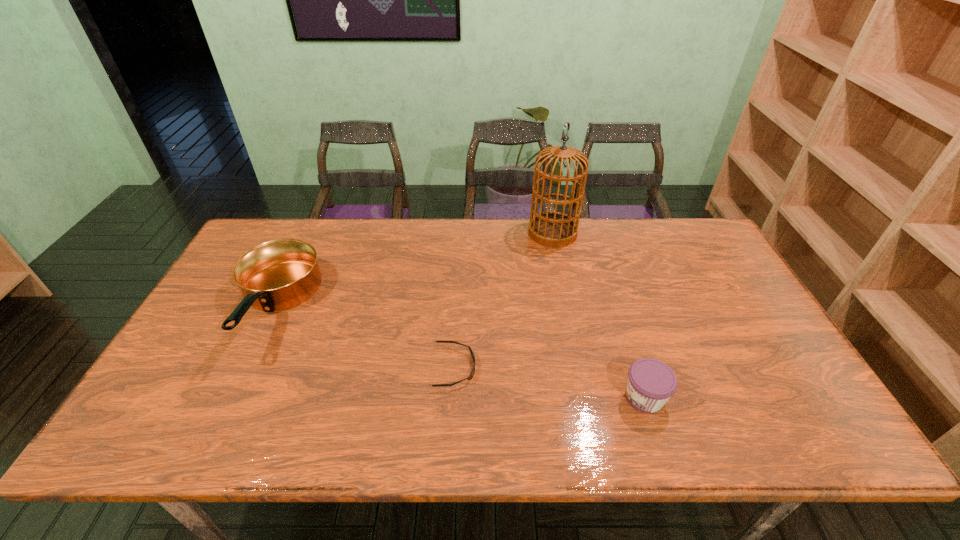
You are a GUI agent. You are given a task and a screenshot of the screen. Output one action in this format:
    pyautogui.click(x=<x>, y=<y>)
    Task: Click on the vacant space at the right edge
    This screenshot has height=540, width=960.
    Given the screenshot: What is the action you would take?
    pyautogui.click(x=707, y=284)

In the image, there is a desktop. Where is `vacant area at the far left corner`? The image size is (960, 540). vacant area at the far left corner is located at coordinates (298, 237).

At what (x,y) coordinates should I click in order to perform the action: click on vacant area at the far right corner of the desktop. Please return your answer as a coordinate pair (x, y). Looking at the image, I should click on (685, 227).

Where is `vacant point located between the farthest object and the leftmost object`? vacant point located between the farthest object and the leftmost object is located at coordinates (414, 269).

Where is `vacant space that is in between the jam and the second object from left to right`? vacant space that is in between the jam and the second object from left to right is located at coordinates click(550, 382).

Identify the location of vacant point located between the sunglasses and the second shortest object. This screenshot has height=540, width=960. (550, 382).

This screenshot has height=540, width=960. Find the location of `free spot between the third tallest object and the third shortest object`. free spot between the third tallest object and the third shortest object is located at coordinates (459, 352).

In order to click on free spot between the jam and the third object from right to left in this screenshot , I will do `click(550, 382)`.

At what (x,y) coordinates should I click in order to perform the action: click on vacant region between the tallest object and the jam. Please return your answer as a coordinate pair (x, y). Image resolution: width=960 pixels, height=540 pixels. Looking at the image, I should click on (598, 315).

This screenshot has width=960, height=540. Identify the location of unoccupied position between the birdcage and the jam. (598, 315).